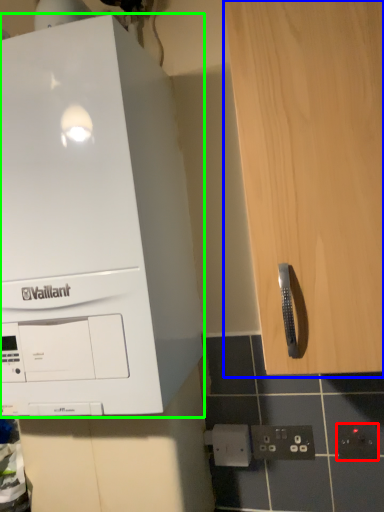
Question: Which object is the farthest from electric outlet (highlighted by a red box)? Choose among these: cabinetry (highlighted by a blue box) or home appliance (highlighted by a green box).

Choices:
 (A) cabinetry
 (B) home appliance

Answer: (B)